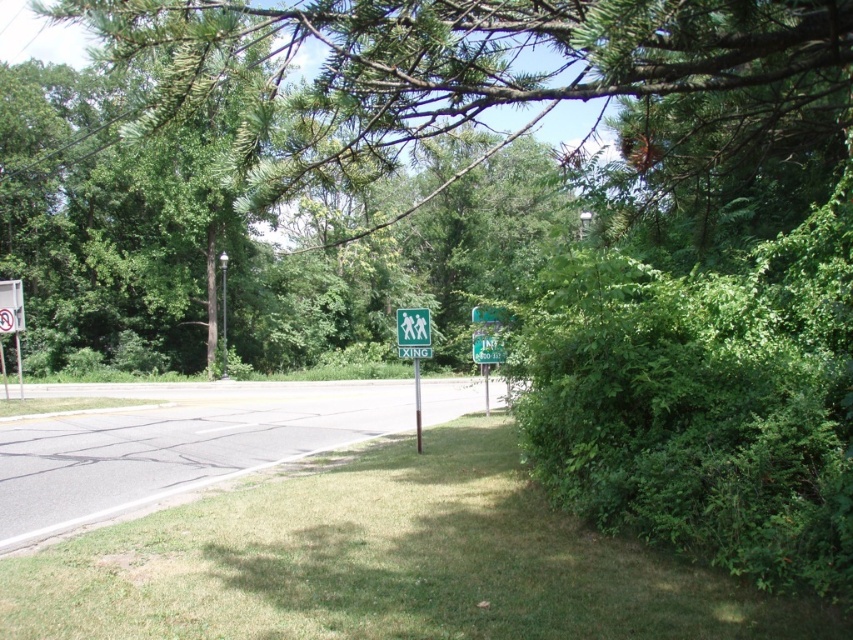
Can you confirm if green plastic sign at center is shorter than green matte pedestrian crossing sign at center?

In fact, green plastic sign at center may be taller than green matte pedestrian crossing sign at center.

Between point (473, 310) and point (399, 339), which one is positioned in front?

Point (399, 339) is in front.

Between point (486, 348) and point (399, 337), which one is positioned behind?

The point (486, 348) is behind.

Find the location of a particular element. Image resolution: width=853 pixels, height=640 pixels. green plastic sign at center is located at coordinates (486, 336).

Does point (634, 33) lie behind point (407, 308)?

That is False.

Measure the distance between green leafy tree at center and camera.

green leafy tree at center is 9.82 feet from camera.

Find the location of `green leafy tree at center`. green leafy tree at center is located at coordinates (444, 67).

Where is `green leafy tree at center`? This screenshot has width=853, height=640. green leafy tree at center is located at coordinates (444, 67).

Consider the image. Does green plastic pedestrian crossing sign at center have a smaller size compared to green matte pedestrian crossing sign at center?

No.

Does point (419, 349) come farther from viewer compared to point (409, 317)?

No, (419, 349) is closer to viewer.

Where is `green plastic pedestrian crossing sign at center`? green plastic pedestrian crossing sign at center is located at coordinates click(415, 349).